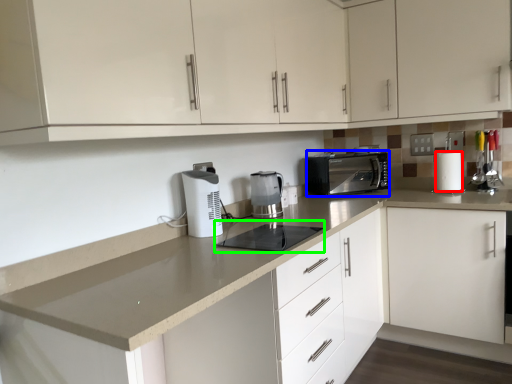
Question: Estimate the real-world distances between objects in this image. Which object is closer to paper towel (highlighted by a red box), kitchen appliance (highlighted by a blue box) or appliance (highlighted by a green box)?

Choices:
 (A) kitchen appliance
 (B) appliance

Answer: (A)